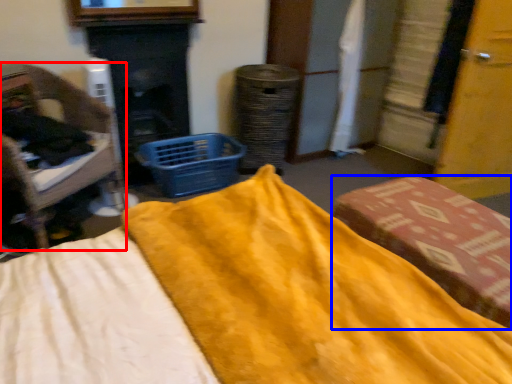
Question: Which of the following is the closest to the observer, furniture (highlighted by a red box) or furniture (highlighted by a blue box)?

Choices:
 (A) furniture
 (B) furniture

Answer: (B)